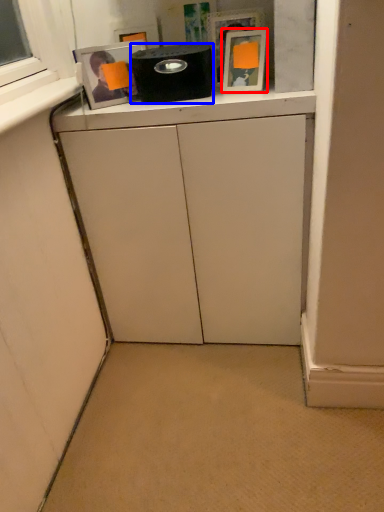
Question: Which point is further to the camera, picture frame (highlighted by a red box) or appliance (highlighted by a blue box)?

Choices:
 (A) picture frame
 (B) appliance

Answer: (B)